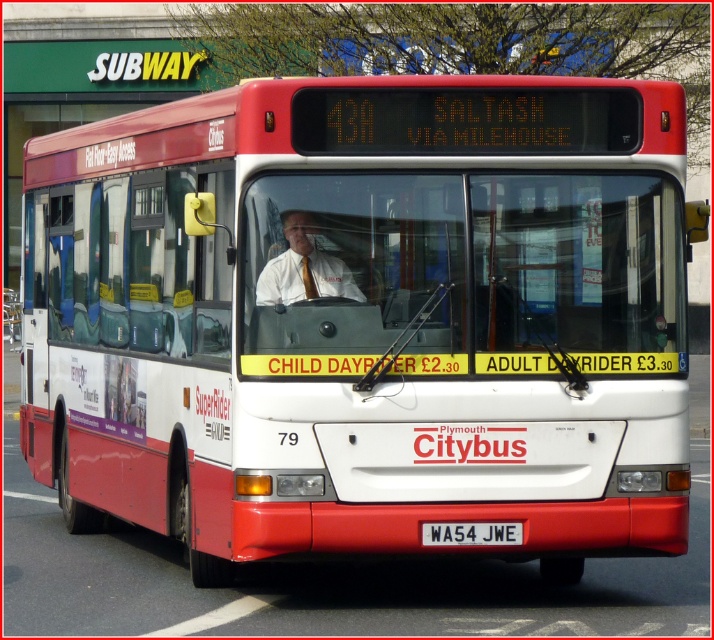
Question: Can you confirm if matte white shirt at center is positioned below white plastic license plate at center?

Choices:
 (A) no
 (B) yes

Answer: (A)

Question: Which object appears closest to the camera in this image?

Choices:
 (A) matte white shirt at center
 (B) white plastic license plate at center

Answer: (B)

Question: Which point is farther to the camera?

Choices:
 (A) (486, 529)
 (B) (336, 276)

Answer: (B)

Question: Is matte white shirt at center positioned at the back of white plastic license plate at center?

Choices:
 (A) yes
 (B) no

Answer: (A)

Question: Considering the relative positions of matte white shirt at center and white plastic license plate at center in the image provided, where is matte white shirt at center located with respect to white plastic license plate at center?

Choices:
 (A) left
 (B) right

Answer: (A)